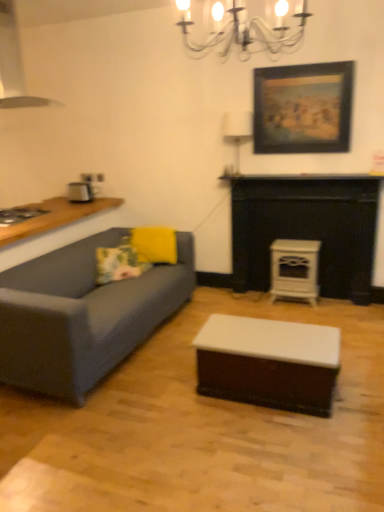
Question: Can you confirm if yellow matte pillow at center, the second pillow viewed from the left, is taller than white fabric lampshade at upper center?

Choices:
 (A) no
 (B) yes

Answer: (A)

Question: Can you confirm if yellow matte pillow at center, acting as the 1th pillow starting from the right, is thinner than white fabric lampshade at upper center?

Choices:
 (A) no
 (B) yes

Answer: (A)

Question: Is yellow matte pillow at center, acting as the 1th pillow starting from the right, further to the viewer compared to white fabric lampshade at upper center?

Choices:
 (A) yes
 (B) no

Answer: (A)

Question: Does yellow matte pillow at center, acting as the 1th pillow starting from the right, have a lesser height compared to white fabric lampshade at upper center?

Choices:
 (A) yes
 (B) no

Answer: (A)

Question: Does yellow matte pillow at center, acting as the 1th pillow starting from the right, appear on the right side of white fabric lampshade at upper center?

Choices:
 (A) no
 (B) yes

Answer: (A)

Question: From the image's perspective, is yellow matte pillow at center, acting as the 1th pillow starting from the right, over white fabric lampshade at upper center?

Choices:
 (A) no
 (B) yes

Answer: (A)

Question: Does white glossy stove at center-right, acting as the second appliance starting from the left, have a greater width compared to floral fabric pillow at left, which is counted as the 2th pillow, starting from the right?

Choices:
 (A) no
 (B) yes

Answer: (A)

Question: Is white glossy stove at center-right, acting as the first appliance starting from the bottom, oriented away from floral fabric pillow at left, which is counted as the 2th pillow, starting from the right?

Choices:
 (A) no
 (B) yes

Answer: (A)

Question: Considering the relative sizes of white glossy stove at center-right, the second appliance from the back, and floral fabric pillow at left, which is counted as the 2th pillow, starting from the right, in the image provided, is white glossy stove at center-right, the second appliance from the back, shorter than floral fabric pillow at left, which is counted as the 2th pillow, starting from the right,?

Choices:
 (A) no
 (B) yes

Answer: (A)

Question: Is white glossy stove at center-right, acting as the second appliance starting from the left, placed right next to floral fabric pillow at left, the 1th pillow in the left-to-right sequence?

Choices:
 (A) no
 (B) yes

Answer: (A)

Question: Is the depth of white glossy stove at center-right, which ranks as the 1th appliance in right-to-left order, less than that of floral fabric pillow at left, which is counted as the 2th pillow, starting from the right?

Choices:
 (A) yes
 (B) no

Answer: (B)

Question: Can you confirm if white glossy stove at center-right, the first appliance in the front-to-back sequence, is positioned to the right of floral fabric pillow at left, the 1th pillow in the left-to-right sequence?

Choices:
 (A) yes
 (B) no

Answer: (A)

Question: Is metallic silver exhaust hood at upper left beside white glossy fireplace at center?

Choices:
 (A) no
 (B) yes

Answer: (A)